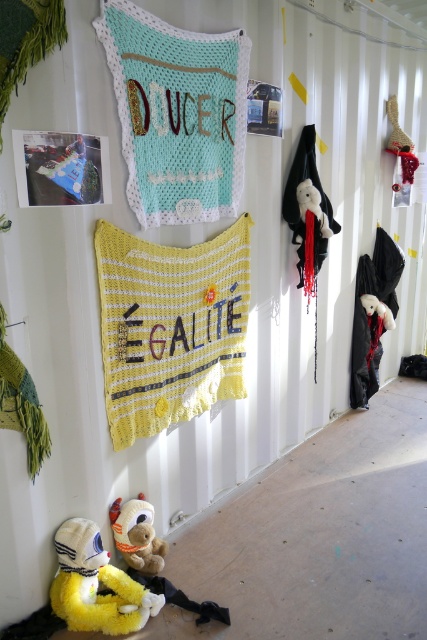
Does crochet fabric pillow at upper center have a greater width compared to yellow plush toy at lower left?

Yes, crochet fabric pillow at upper center is wider than yellow plush toy at lower left.

Which is behind, point (187, 218) or point (98, 572)?

The point (187, 218) is behind.

I want to click on crochet fabric pillow at upper center, so click(x=177, y=113).

Can you confirm if yellow plush toy at lower left is bigger than brown plush teddy bear at lower left?

Yes, yellow plush toy at lower left is bigger than brown plush teddy bear at lower left.

Between yellow plush toy at lower left and brown plush teddy bear at lower left, which one appears on the left side from the viewer's perspective?

Positioned to the left is yellow plush toy at lower left.

Locate an element on the screen. yellow plush toy at lower left is located at coordinates (96, 584).

Describe the element at coordinates (96, 584) in the screenshot. I see `yellow plush toy at lower left` at that location.

Who is shorter, yellow plush toy at lower left or black matte bat at right?

With less height is yellow plush toy at lower left.

What do you see at coordinates (96, 584) in the screenshot? This screenshot has width=427, height=640. I see `yellow plush toy at lower left` at bounding box center [96, 584].

At what (x,y) coordinates should I click in order to perform the action: click on yellow plush toy at lower left. Please return your answer as a coordinate pair (x, y). Looking at the image, I should click on (96, 584).